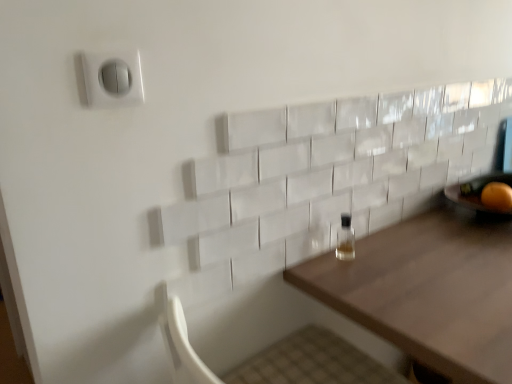
Locate an element on the screen. free spot in front of clear glass bottle at center is located at coordinates (379, 288).